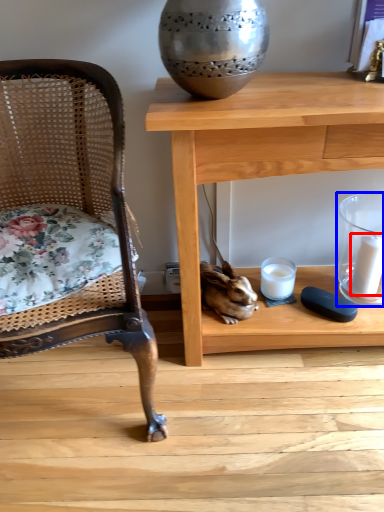
Question: Among these objects, which one is farthest to the camera, candle (highlighted by a red box) or candle holder (highlighted by a blue box)?

Choices:
 (A) candle
 (B) candle holder

Answer: (A)